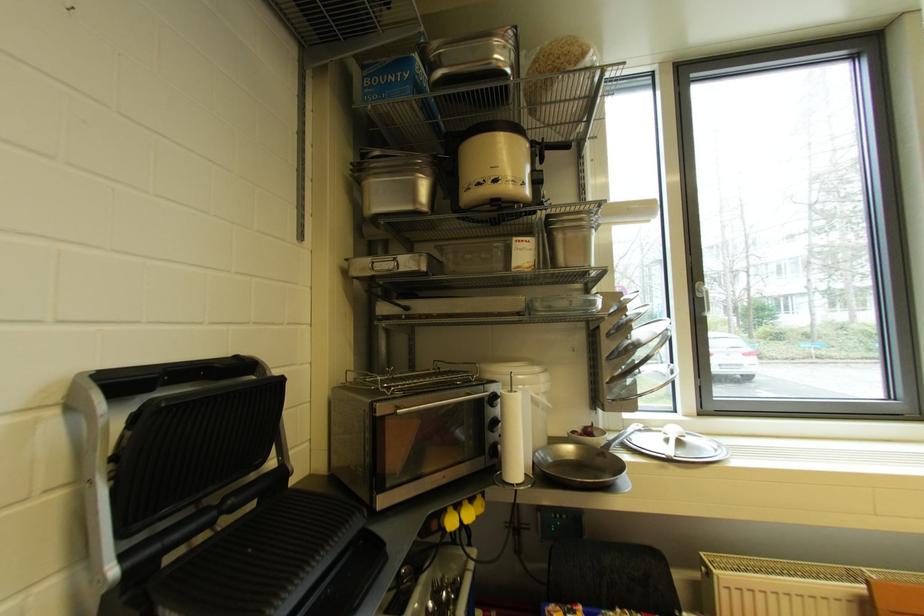
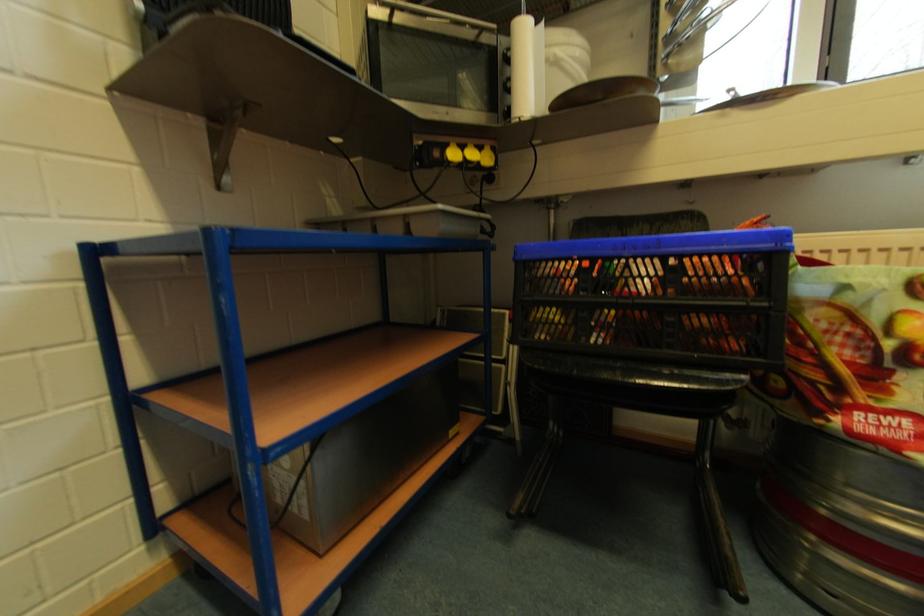
Question: What movement of the cameraman would produce the second image?

Choices:
 (A) Left
 (B) Right
 (C) Forward
 (D) Backward

Answer: (B)